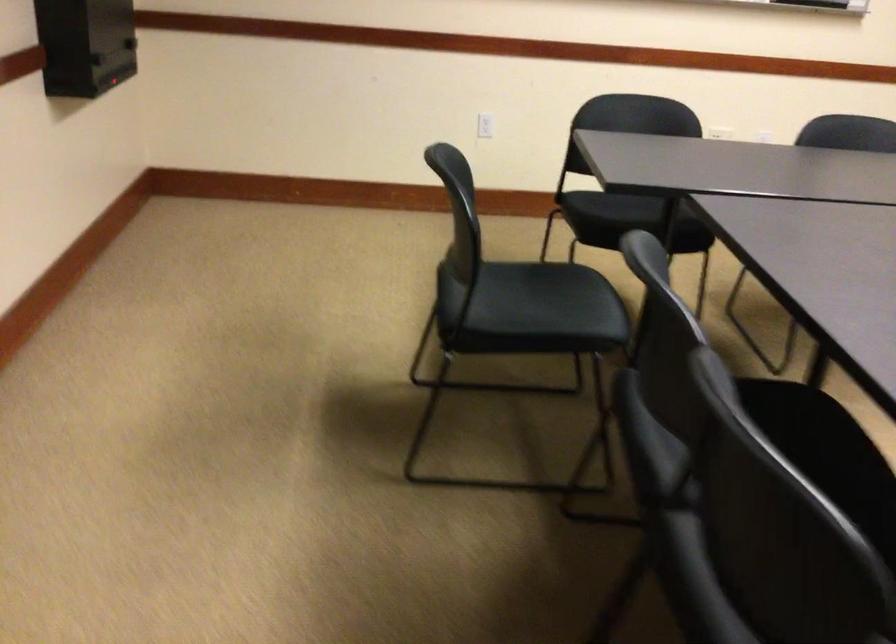
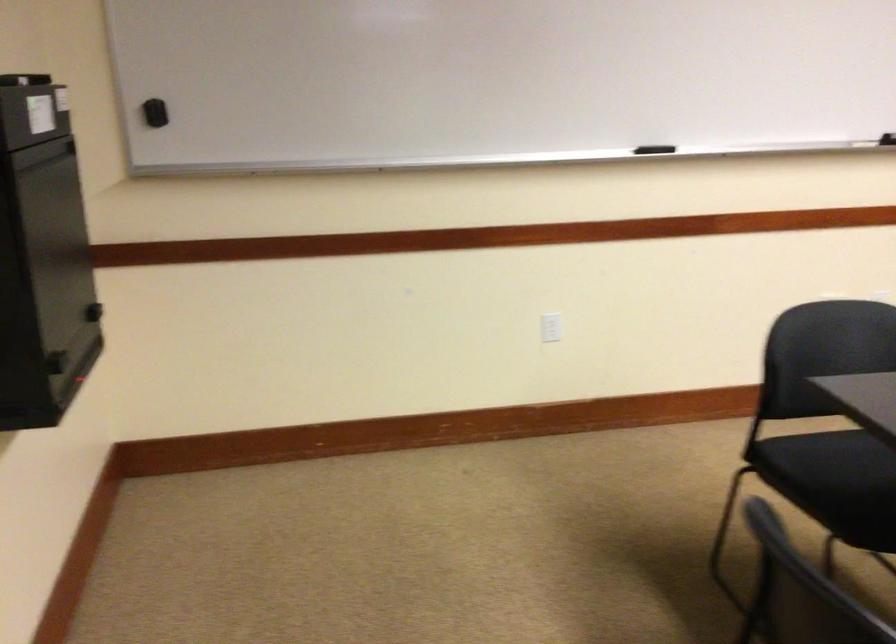
Question: The images are taken continuously from a first-person perspective. In which direction are you moving?

Choices:
 (A) Left
 (B) Right
 (C) Forward
 (D) Backward

Answer: (D)